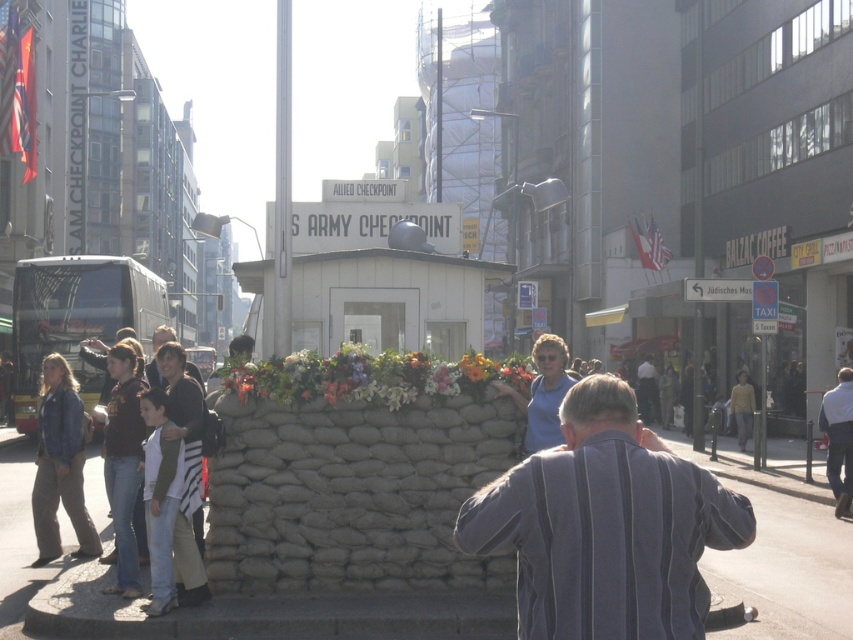
Question: Is striped fabric shirt at center thinner than gray concrete pavement at center?

Choices:
 (A) no
 (B) yes

Answer: (B)

Question: Is striped fabric shirt at center wider than gray concrete pavement at center?

Choices:
 (A) yes
 (B) no

Answer: (B)

Question: Which of the following is the farthest from the observer?

Choices:
 (A) (16, 397)
 (B) (558, 602)

Answer: (A)

Question: Which of the following is the closest to the observer?

Choices:
 (A) (16, 321)
 (B) (712, 464)
 (C) (541, 483)

Answer: (C)

Question: Can you confirm if striped fabric shirt at center is thinner than yellowish metallic bus at left?

Choices:
 (A) yes
 (B) no

Answer: (A)

Question: Which object is closer to the camera taking this photo?

Choices:
 (A) gray concrete pavement at center
 (B) striped fabric shirt at center

Answer: (B)